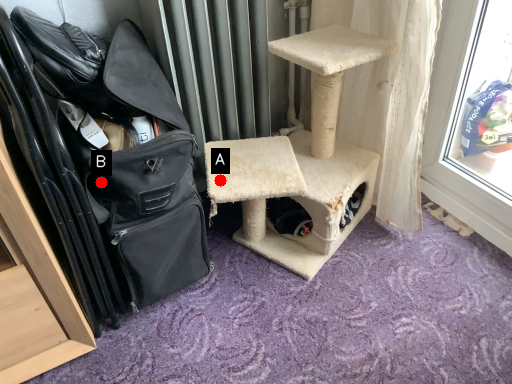
Question: Two points are circled on the image, labeled by A and B beside each circle. Which point is farther to the camera?

Choices:
 (A) A is further
 (B) B is further

Answer: (A)